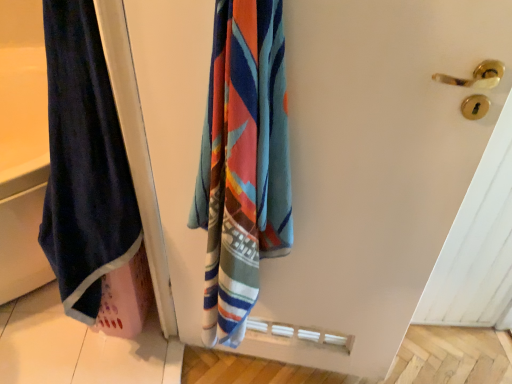
Question: From a real-world perspective, relative to velvet dark blue towel at left, is velvet dark blue towel at left vertically above or below?

Choices:
 (A) above
 (B) below

Answer: (A)

Question: Does point (50, 49) appear closer or farther from the camera than point (318, 61)?

Choices:
 (A) closer
 (B) farther

Answer: (B)

Question: Is velvet dark blue towel at left to the left or to the right of velvet dark blue towel at left in the image?

Choices:
 (A) left
 (B) right

Answer: (A)

Question: In terms of height, does velvet dark blue towel at left look taller or shorter compared to velvet dark blue towel at left?

Choices:
 (A) tall
 (B) short

Answer: (A)

Question: Visually, is velvet dark blue towel at left positioned to the left or to the right of velvet dark blue towel at left?

Choices:
 (A) right
 (B) left

Answer: (A)

Question: Considering the positions of point (486, 36) and point (91, 235), is point (486, 36) closer or farther from the camera than point (91, 235)?

Choices:
 (A) closer
 (B) farther

Answer: (A)

Question: Is velvet dark blue towel at left bigger or smaller than velvet dark blue towel at left?

Choices:
 (A) big
 (B) small

Answer: (B)